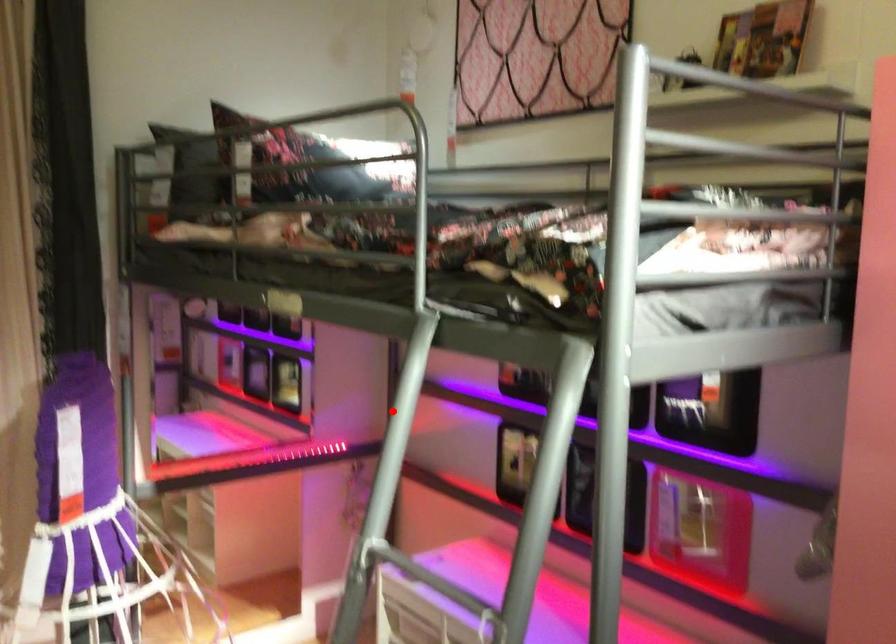
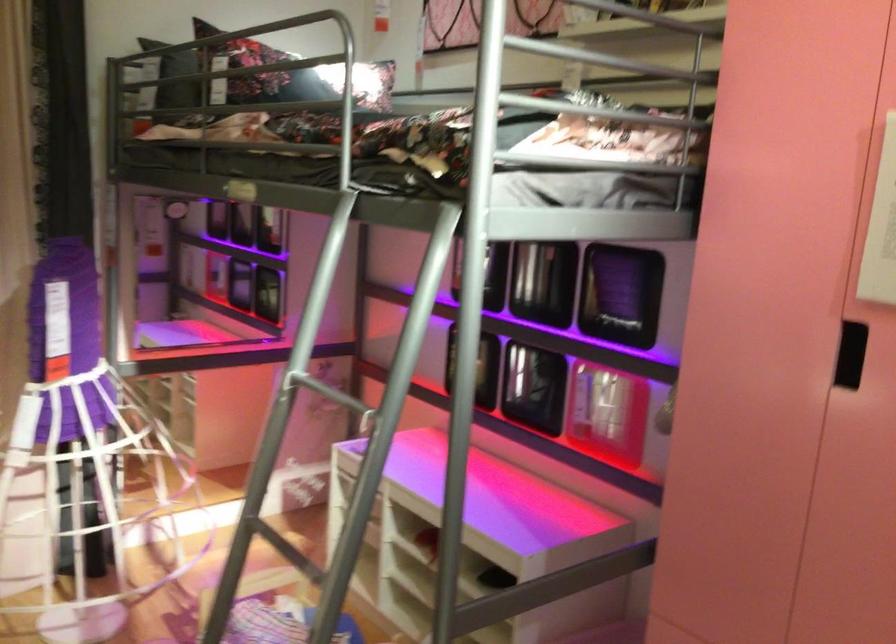
Question: I am providing you with two images of the same scene from different viewpoints. A red point is marked on the first image. Is the red point's position out of view in image 2?

Choices:
 (A) Yes
 (B) No

Answer: (B)